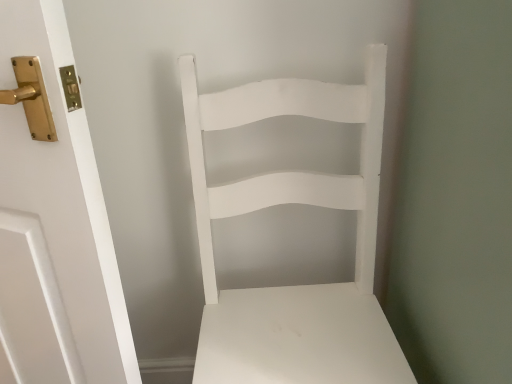
Question: Should I look upward or downward to see white matte chair at center?

Choices:
 (A) up
 (B) down

Answer: (B)